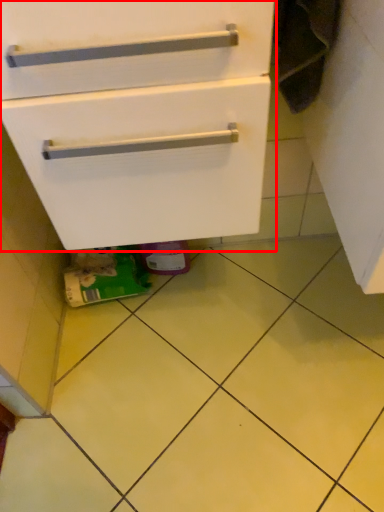
Question: Considering the relative positions of cabinetry (annotated by the red box) and ceramic tile in the image provided, where is cabinetry (annotated by the red box) located with respect to the staircase?

Choices:
 (A) right
 (B) left

Answer: (B)